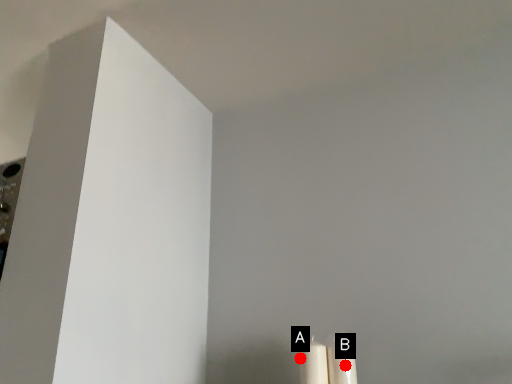
Question: Two points are circled on the image, labeled by A and B beside each circle. Which point is farther to the camera?

Choices:
 (A) A is further
 (B) B is further

Answer: (A)